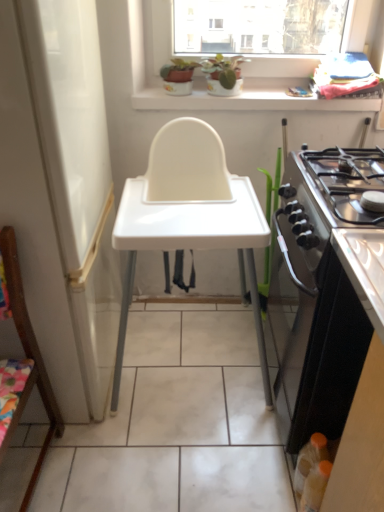
Identify the location of vacant space behind translucent plastic bottle at lower right. (266, 444).